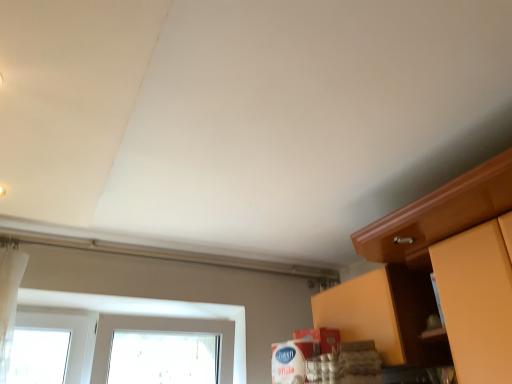
Question: From the image's perspective, is matte wood cabinet at lower right, the first cabinetry from the back, above or below matte wood cabinet at right, the 2th cabinetry viewed from the back?

Choices:
 (A) above
 (B) below

Answer: (B)

Question: Would you say matte wood cabinet at lower right, the first cabinetry from the back, is inside or outside matte wood cabinet at right, which is counted as the 1th cabinetry, starting from the front?

Choices:
 (A) inside
 (B) outside

Answer: (B)

Question: From a real-world perspective, is matte wood cabinet at lower right, positioned as the second cabinetry in front-to-back order, above or below matte wood cabinet at right, which is counted as the 1th cabinetry, starting from the front?

Choices:
 (A) below
 (B) above

Answer: (B)

Question: Which is correct: matte wood cabinet at right, which is counted as the 1th cabinetry, starting from the front, is inside matte wood cabinet at lower right, positioned as the second cabinetry in front-to-back order, or outside of it?

Choices:
 (A) inside
 (B) outside

Answer: (B)

Question: Looking at the image, does matte wood cabinet at right, the 2th cabinetry viewed from the back, seem bigger or smaller compared to matte wood cabinet at lower right, the first cabinetry from the back?

Choices:
 (A) small
 (B) big

Answer: (A)

Question: From a real-world perspective, is matte wood cabinet at right, the 2th cabinetry viewed from the back, positioned above or below matte wood cabinet at lower right, positioned as the second cabinetry in front-to-back order?

Choices:
 (A) below
 (B) above

Answer: (A)

Question: Considering the relative positions of matte wood cabinet at right, the 2th cabinetry viewed from the back, and matte wood cabinet at lower right, positioned as the second cabinetry in front-to-back order, in the image provided, is matte wood cabinet at right, the 2th cabinetry viewed from the back, to the left or to the right of matte wood cabinet at lower right, positioned as the second cabinetry in front-to-back order,?

Choices:
 (A) left
 (B) right

Answer: (B)